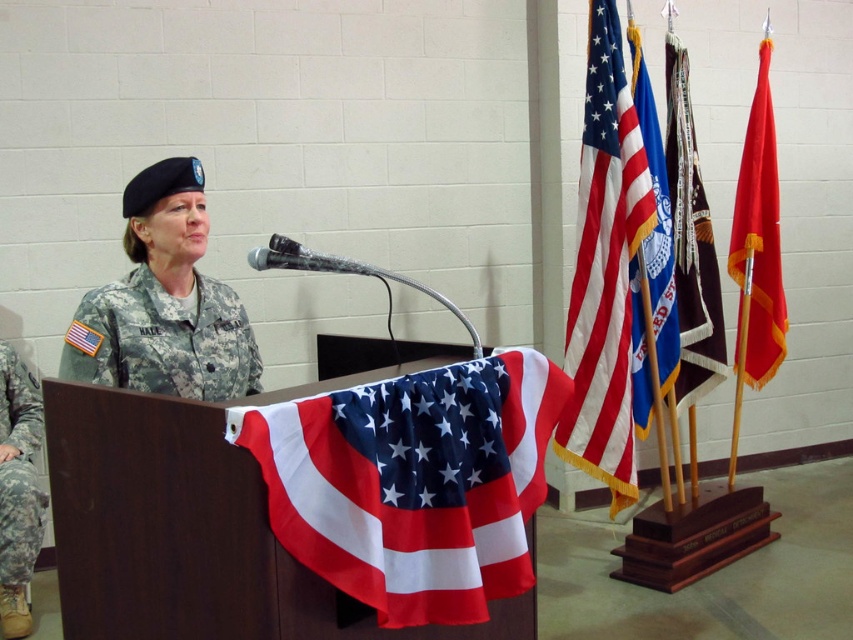
You are a photographer setting up for a military presentation. You need to ensure that the distance between the american flag at upper right and the camouflage fabric uniform at center is exactly 6 feet for proper framing. Based on the current setup, is the distance sufficient?

The american flag at upper right is 5.66 feet away from the camouflage fabric uniform at center, which is slightly less than the required 6 feet. The distance is insufficient and needs adjustment.

Based on the scene description, can you determine which object is taller between the polyester american flag at center and the camouflage fabric uniform at center?

The polyester american flag at center is taller than the camouflage fabric uniform at center.

Based on the coordinates given, which object is located at point (605, 268)?

The American flag at upper right is located at point (605, 268).